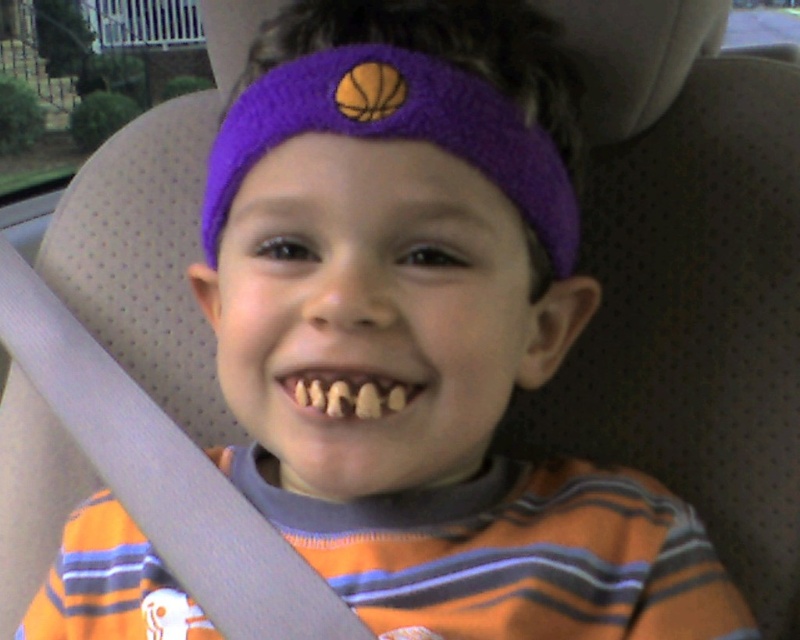
You are a dentist examining a child in a car seat. You need to check the yellowish matte teeth at center. Is the purple knitted headband at center too close to the teeth to interfere with your examination?

The distance between the purple knitted headband at center and the yellowish matte teeth at center is 13.02 centimeters. Since this distance is sufficient, the headband is not too close to interfere with the examination of the teeth.

You are a dentist examining a child in a car seat. You notice the purple knitted headband at center and the yellowish matte teeth at center. Which object is wider?

The purple knitted headband at center is wider than the yellowish matte teeth at center.